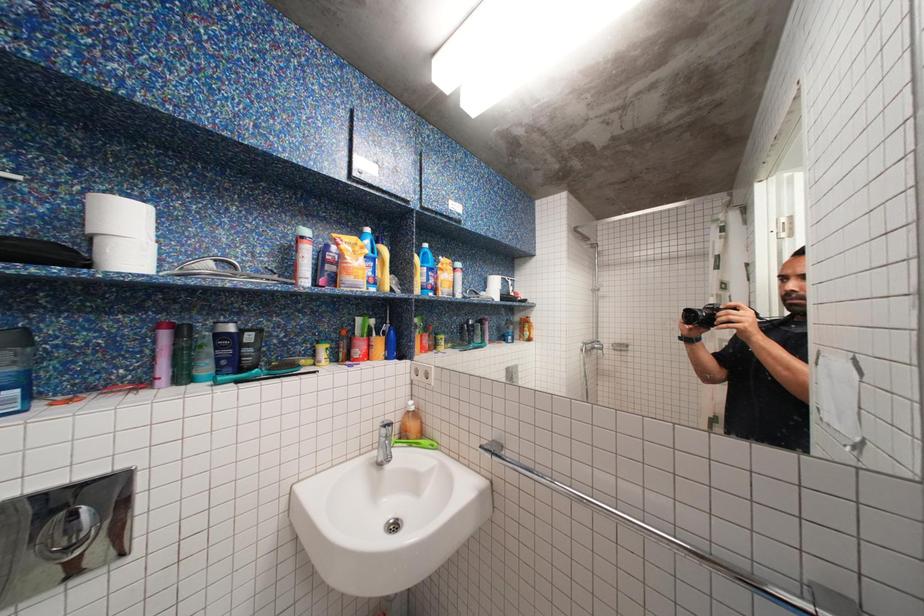
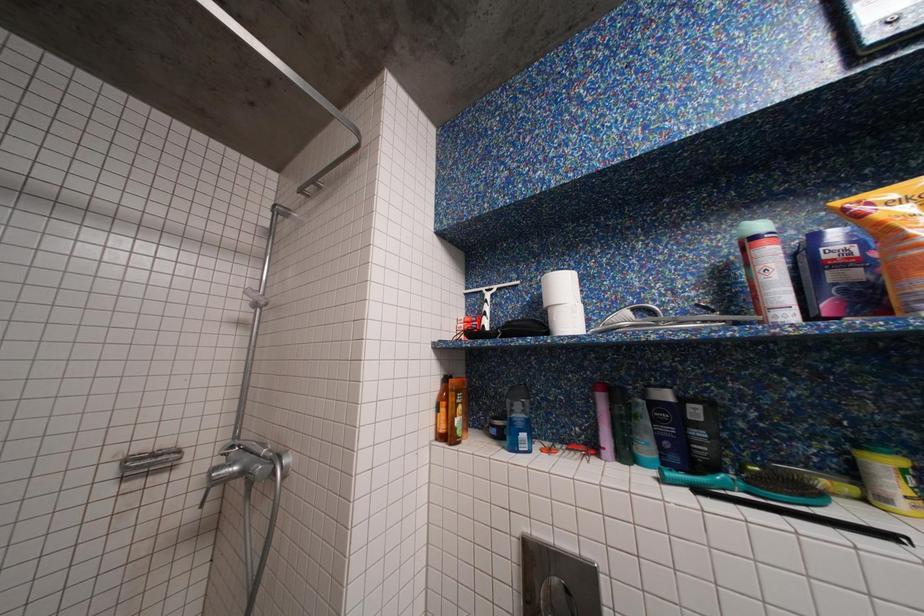
Question: The camera is either moving clockwise (left) or counter-clockwise (right) around the object. The first image is from the beginning of the video and the second image is from the end. Is the camera moving left or right when shooting the video?

Choices:
 (A) Left
 (B) Right

Answer: (B)